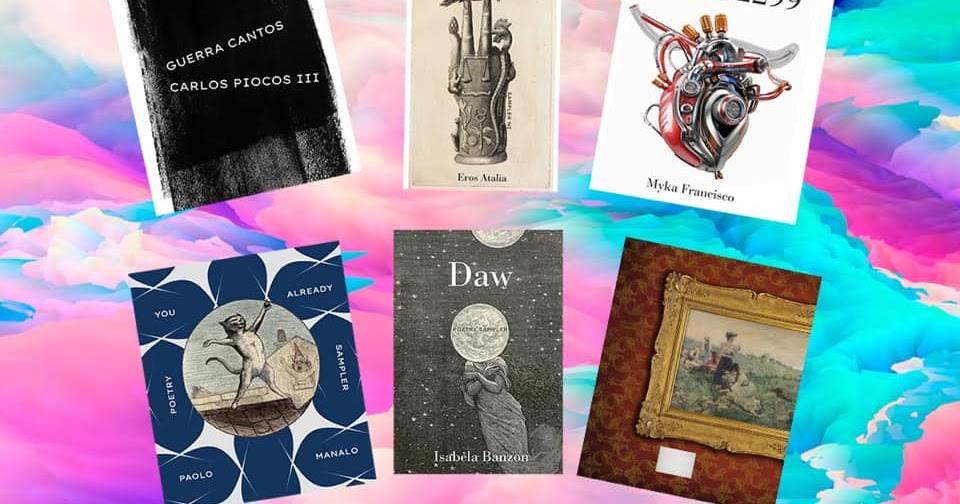
Where is `picture frame`? picture frame is located at coordinates (653, 416).